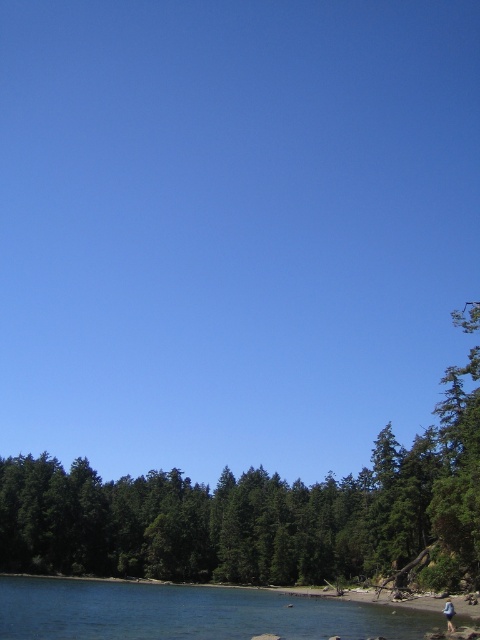
Question: Among these points, which one is farthest from the camera?

Choices:
 (A) (297, 625)
 (B) (453, 608)
 (C) (7, 516)

Answer: (C)

Question: Is clear blue water at lower left bigger than blue denim jeans at lower right?

Choices:
 (A) no
 (B) yes

Answer: (B)

Question: Does green leafy tree at lower center have a larger size compared to blue denim jeans at lower right?

Choices:
 (A) no
 (B) yes

Answer: (B)

Question: Is clear blue water at lower left further to the viewer compared to blue denim jeans at lower right?

Choices:
 (A) no
 (B) yes

Answer: (A)

Question: Which of the following is the farthest from the observer?

Choices:
 (A) green leafy tree at lower center
 (B) clear blue water at lower left

Answer: (A)

Question: Among these objects, which one is farthest from the camera?

Choices:
 (A) clear blue water at lower left
 (B) green leafy tree at lower center
 (C) blue denim jeans at lower right

Answer: (B)